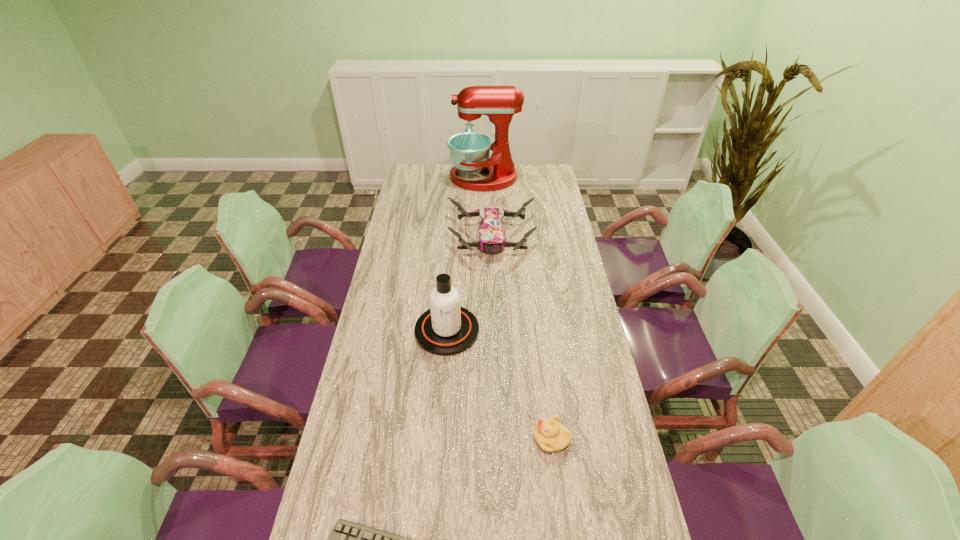
The image size is (960, 540). I want to click on the tallest object, so click(469, 151).

Find the location of `mixer`. mixer is located at coordinates (469, 151).

Identify the location of the second tallest object. The image size is (960, 540). (446, 329).

This screenshot has width=960, height=540. Find the location of `cleansing agent`. cleansing agent is located at coordinates (446, 329).

Find the location of a particular element. the third tallest object is located at coordinates (492, 235).

Where is `drone`? The image size is (960, 540). drone is located at coordinates (492, 235).

What are the coordinates of `duckling` in the screenshot? It's located at (550, 435).

You are a GUI agent. You are given a task and a screenshot of the screen. Output one action in this format:
    pyautogui.click(x=<x>, y=<y>)
    Task: Click on the second shortest object
    This screenshot has height=540, width=960.
    Given the screenshot: What is the action you would take?
    pyautogui.click(x=550, y=435)

This screenshot has height=540, width=960. What are the coordinates of `free location located on the front-facing side of the tallest object` in the screenshot? It's located at (432, 178).

This screenshot has height=540, width=960. In order to click on blank space located 0.120m on the front-facing side of the tallest object in this screenshot , I will do `click(426, 178)`.